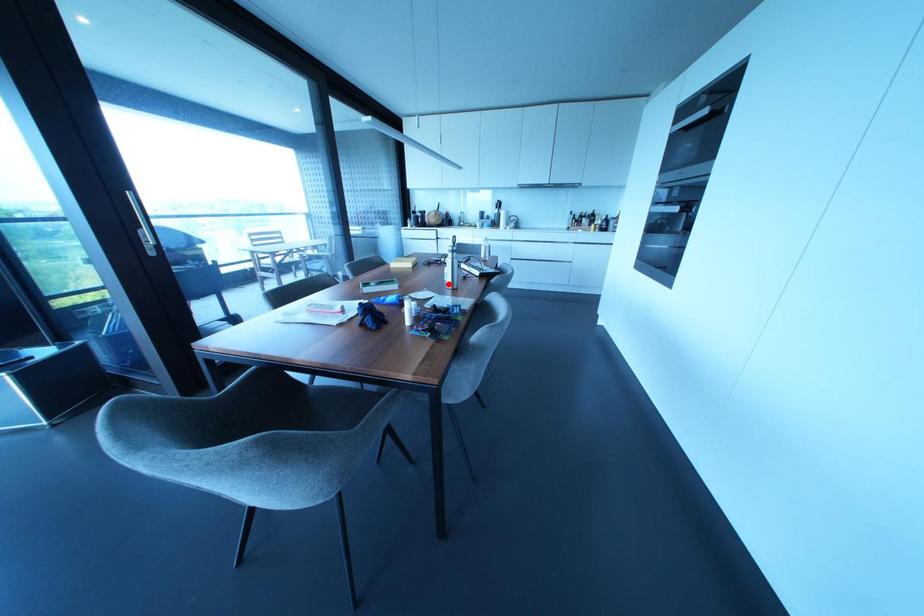
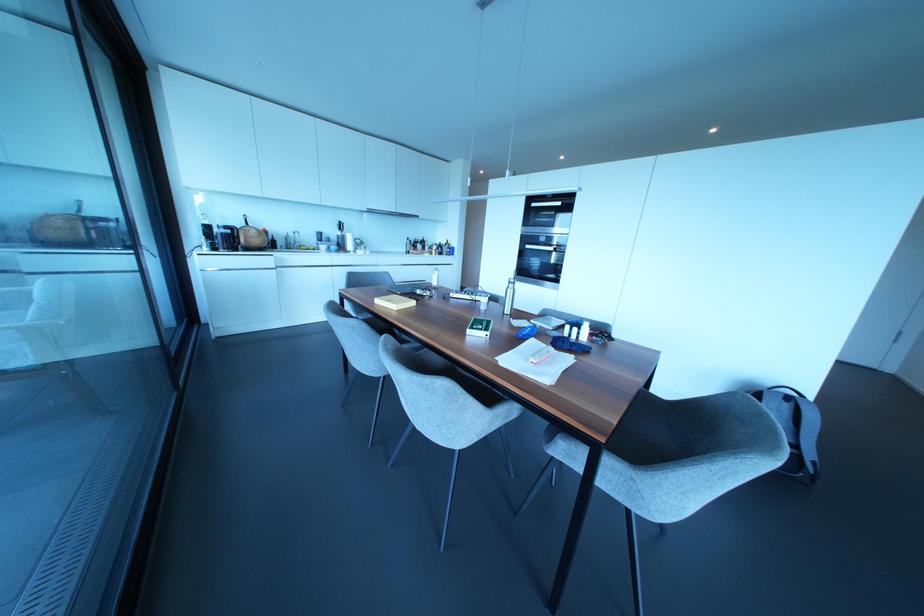
Locate, in the second image, the point that corresponds to the highlighted location in the first image.

(506, 310)